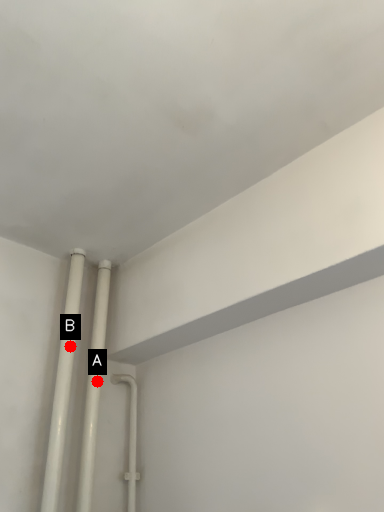
Question: Two points are circled on the image, labeled by A and B beside each circle. Which of the following is the farthest from the observer?

Choices:
 (A) A is further
 (B) B is further

Answer: (A)